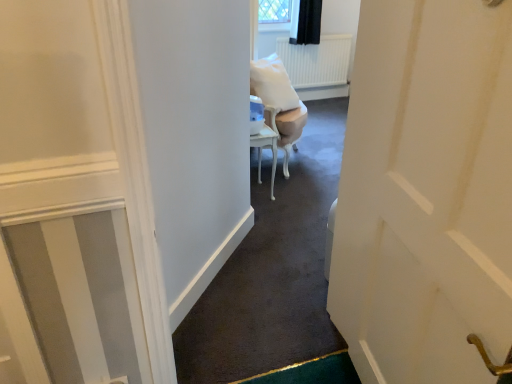
Question: Is point (292, 145) closer or farther from the camera than point (270, 142)?

Choices:
 (A) closer
 (B) farther

Answer: (B)

Question: Considering the positions of white glossy chair at center and white glossy table at center in the image, is white glossy chair at center taller or shorter than white glossy table at center?

Choices:
 (A) tall
 (B) short

Answer: (A)

Question: In terms of width, does white glossy chair at center look wider or thinner when compared to white glossy table at center?

Choices:
 (A) wide
 (B) thin

Answer: (A)

Question: Is white glossy table at center bigger or smaller than white glossy chair at center?

Choices:
 (A) small
 (B) big

Answer: (A)

Question: Would you say white glossy table at center is inside or outside white glossy chair at center?

Choices:
 (A) inside
 (B) outside

Answer: (B)

Question: Does point (267, 142) appear closer or farther from the camera than point (276, 97)?

Choices:
 (A) closer
 (B) farther

Answer: (A)

Question: Is white glossy table at center in front of or behind white glossy chair at center in the image?

Choices:
 (A) behind
 (B) front

Answer: (B)